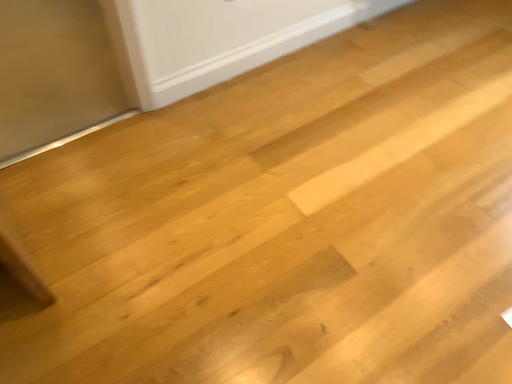
Locate an element on the screen. Image resolution: width=512 pixels, height=384 pixels. clear glass screen door at left is located at coordinates (56, 74).

What is the approximate height of clear glass screen door at left?

2.18 inches.

The image size is (512, 384). What do you see at coordinates (56, 74) in the screenshot?
I see `clear glass screen door at left` at bounding box center [56, 74].

Locate an element on the screen. The height and width of the screenshot is (384, 512). clear glass screen door at left is located at coordinates [56, 74].